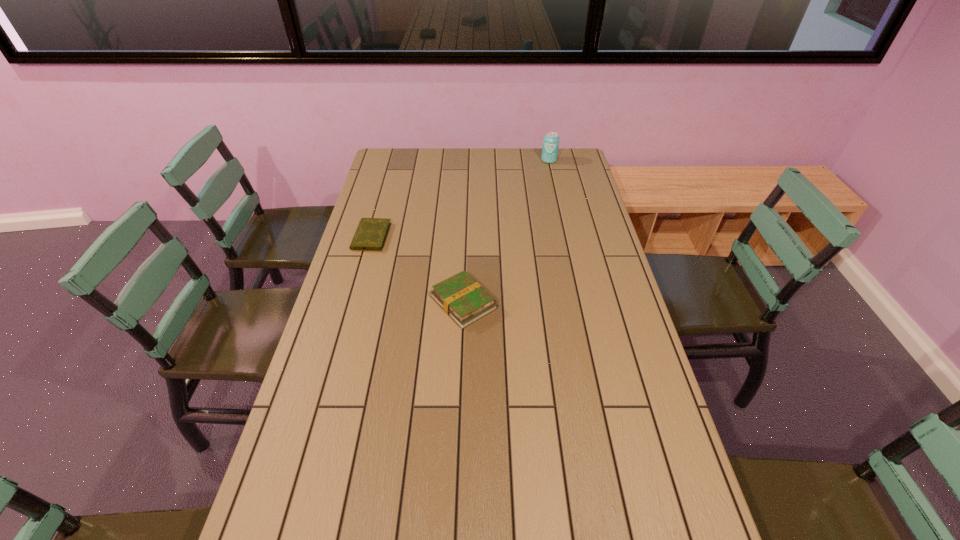
Identify the location of beer can. (550, 147).

Locate an element on the screen. This screenshot has width=960, height=540. the tallest object is located at coordinates click(550, 147).

I want to click on the second object from left to right, so click(460, 296).

Where is `the nearest object`? Image resolution: width=960 pixels, height=540 pixels. the nearest object is located at coordinates (460, 296).

Locate an element on the screen. The height and width of the screenshot is (540, 960). the shortest object is located at coordinates (371, 233).

I want to click on the leftmost object, so click(371, 233).

The width and height of the screenshot is (960, 540). I want to click on free space located 0.110m on the right of the farthest object, so click(581, 160).

At what (x,y) coordinates should I click in order to perform the action: click on free region located on the back of the nearest object. Please return your answer as a coordinate pair (x, y). Image resolution: width=960 pixels, height=540 pixels. Looking at the image, I should click on (466, 238).

Where is `free region located 0.170m on the back of the second nearest object`? The image size is (960, 540). free region located 0.170m on the back of the second nearest object is located at coordinates (382, 197).

This screenshot has width=960, height=540. Find the location of `object at the far edge`. object at the far edge is located at coordinates (550, 147).